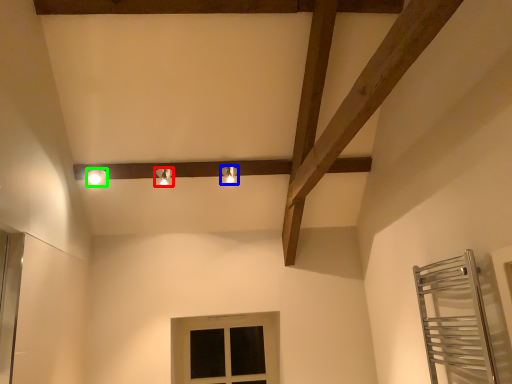
Question: Which is farther away from light fixture (highlighted by a red box)? light fixture (highlighted by a blue box) or light fixture (highlighted by a green box)?

Choices:
 (A) light fixture
 (B) light fixture

Answer: (A)